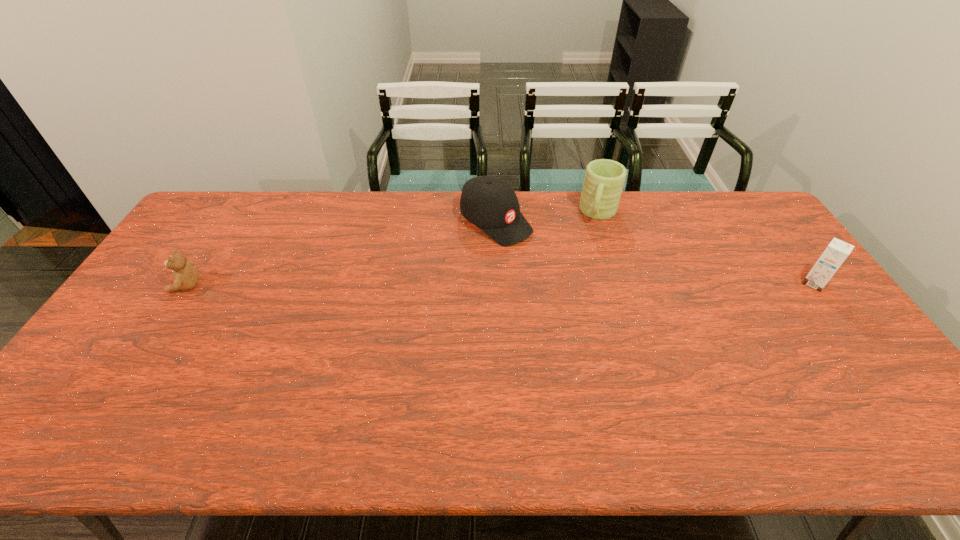
At what (x,y) coordinates should I click in order to perform the action: click on free space at the near left corner. Please return your answer as a coordinate pair (x, y). The image size is (960, 540). Looking at the image, I should click on (118, 390).

I want to click on vacant area that lies between the third object from left to right and the teddy bear, so click(393, 249).

Find the location of `free space that is in between the teddy bear and the second object from right to left`. free space that is in between the teddy bear and the second object from right to left is located at coordinates coord(393,249).

At what (x,y) coordinates should I click in order to perform the action: click on vacant region between the rightmost object and the baseball cap. Please return your answer as a coordinate pair (x, y). The width and height of the screenshot is (960, 540). Looking at the image, I should click on (655, 253).

This screenshot has width=960, height=540. Find the location of `unoccupied position between the mug and the second object from left to right`. unoccupied position between the mug and the second object from left to right is located at coordinates (547, 218).

Where is `vacant space that's between the leftmost object and the rightmost object`? vacant space that's between the leftmost object and the rightmost object is located at coordinates (499, 285).

Find the location of a particular element. Image resolution: width=960 pixels, height=540 pixels. free space between the leftmost object and the baseball cap is located at coordinates (341, 254).

The width and height of the screenshot is (960, 540). Find the location of `free area in between the chocolate milk and the baseball cap`. free area in between the chocolate milk and the baseball cap is located at coordinates (655, 253).

Image resolution: width=960 pixels, height=540 pixels. I want to click on free area in between the leftmost object and the third object from left to right, so [x=393, y=249].

The height and width of the screenshot is (540, 960). I want to click on vacant space that's between the second object from left to right and the third object from left to right, so click(x=547, y=218).